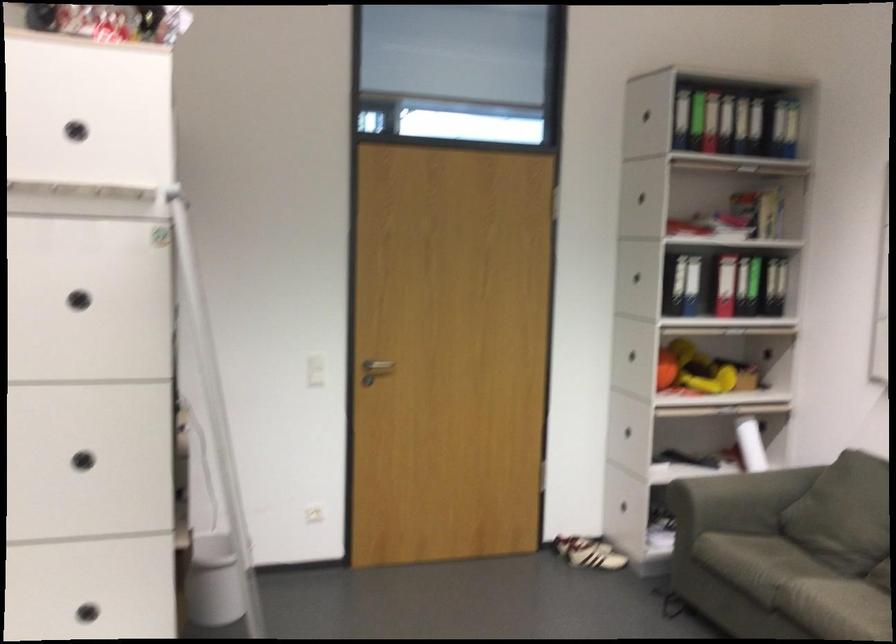
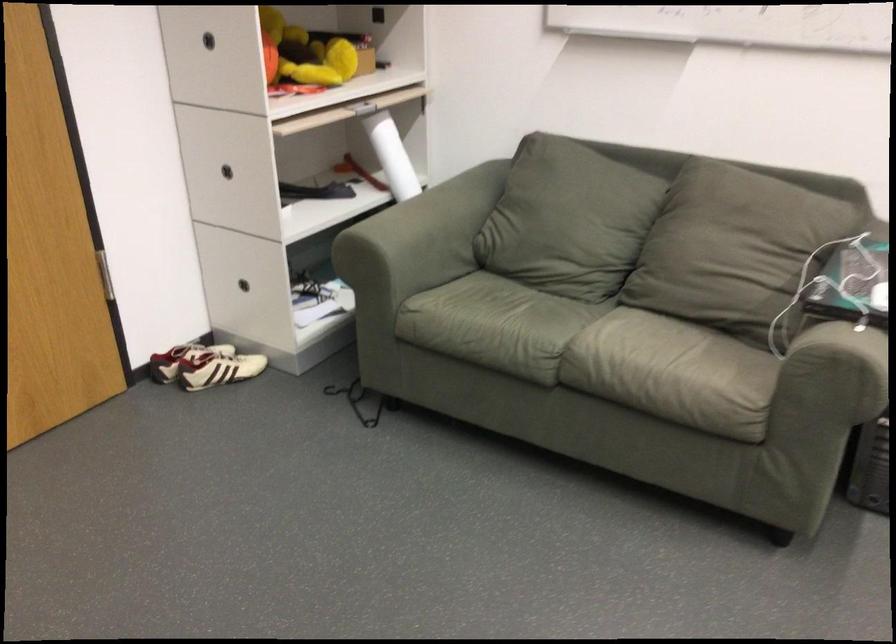
Find the pixel in the second image that matches (x=576, y=556) in the first image.

(218, 368)